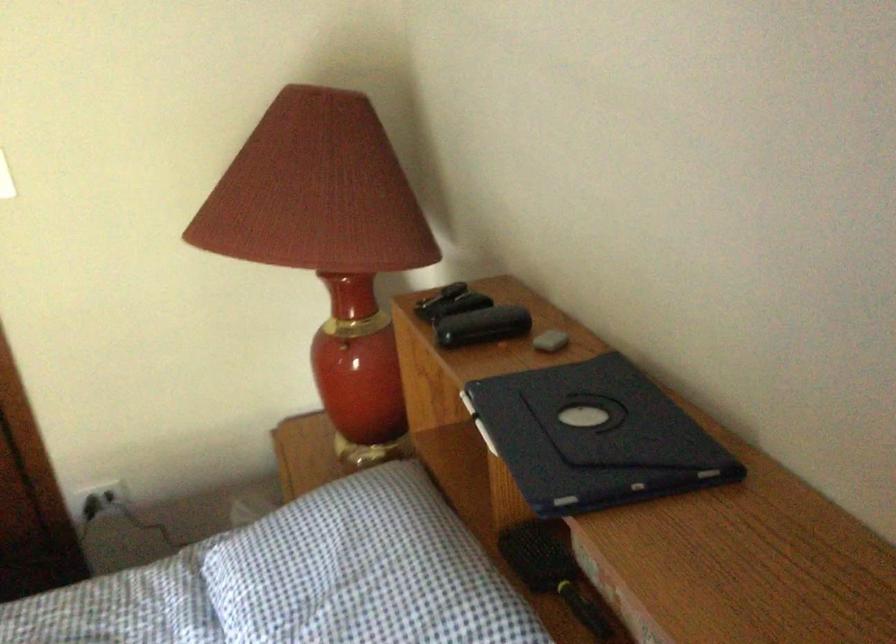
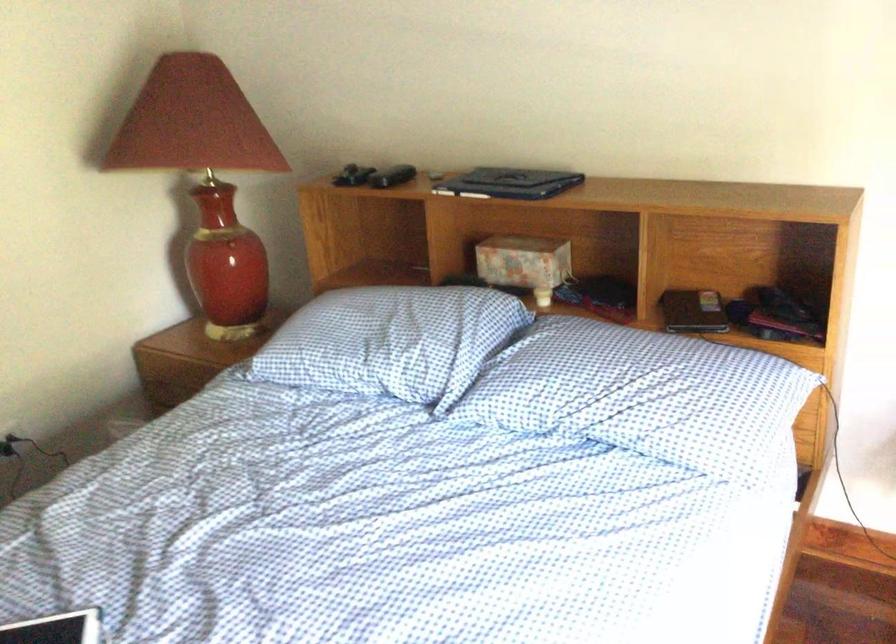
Where in the second image is the point corresponding to (442,314) from the first image?

(352, 176)